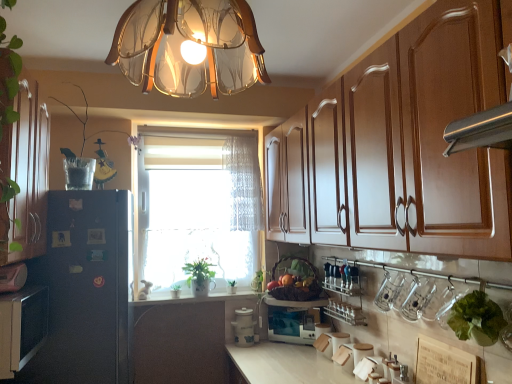
In order to click on vacant area located to the right-hand side of green leafy plant at window, which is the 3th plant in right-to-left order in this screenshot , I will do `click(198, 296)`.